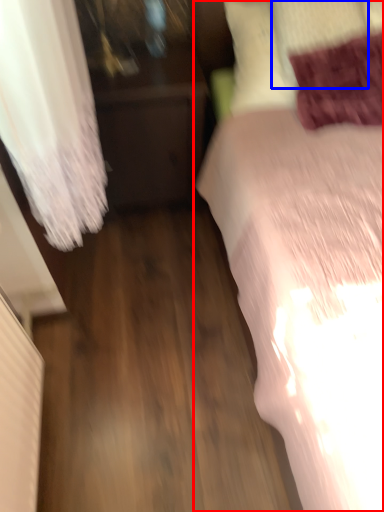
Question: Which of the following is the closest to the observer, bed (highlighted by a red box) or pillow (highlighted by a blue box)?

Choices:
 (A) bed
 (B) pillow

Answer: (A)